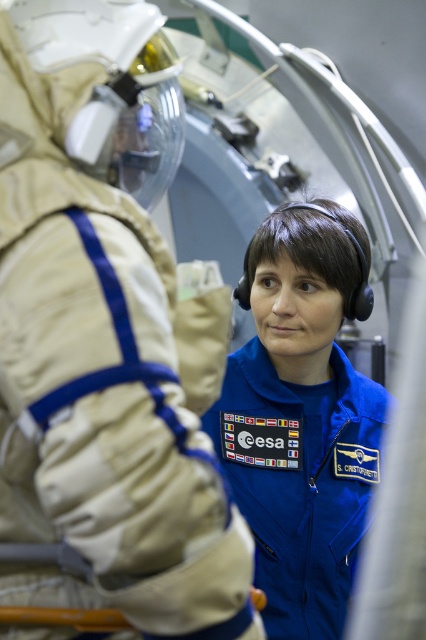
Between beige fabric spacesuit at center and blue fabric astronaut suit at center, which one has less height?

Standing shorter between the two is beige fabric spacesuit at center.

Who is more forward, (230, 573) or (302, 364)?

Point (230, 573) is in front.

Consider the image. Who is more distant from viewer, (65, 65) or (348, 298)?

Positioned behind is point (348, 298).

The image size is (426, 640). In order to click on beige fabric spacesuit at center in this screenshot , I will do `click(106, 339)`.